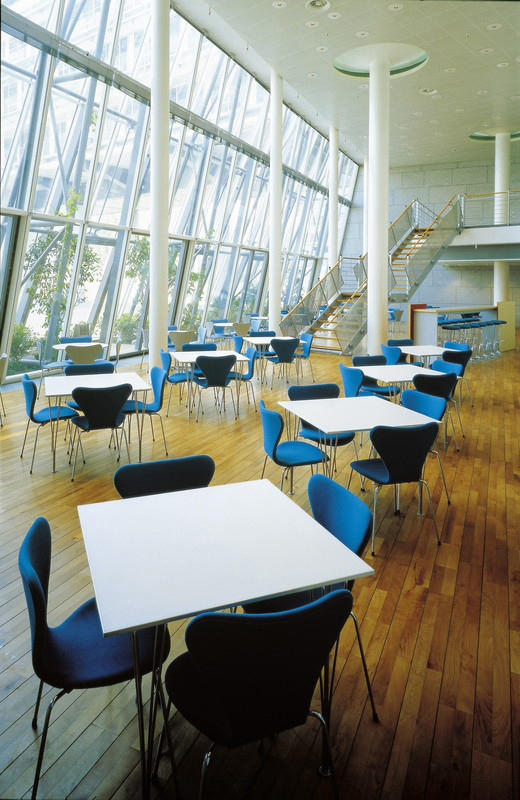
Identify the location of support pillars. This screenshot has width=520, height=800. (162, 222), (273, 216), (331, 194), (377, 210), (365, 237), (501, 170).